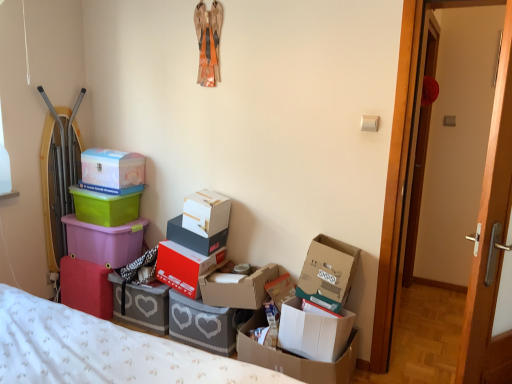
Question: Could you tell me if green plastic container at upper left, which is the 2th box from left to right, is facing cardboard box at right, which is counted as the 12th box, starting from the left?

Choices:
 (A) yes
 (B) no

Answer: (B)

Question: Does green plastic container at upper left, positioned as the 11th box in right-to-left order, have a larger size compared to cardboard box at right, which is counted as the 1th box, starting from the right?

Choices:
 (A) yes
 (B) no

Answer: (B)

Question: Can you confirm if green plastic container at upper left, which is the 2th box from left to right, is positioned to the right of cardboard box at right, which is counted as the 1th box, starting from the right?

Choices:
 (A) no
 (B) yes

Answer: (A)

Question: Is green plastic container at upper left, which is the 2th box from left to right, not inside cardboard box at right, which is counted as the 1th box, starting from the right?

Choices:
 (A) yes
 (B) no

Answer: (A)

Question: Is green plastic container at upper left, which is the 2th box from left to right, taller than cardboard box at right, which is counted as the 12th box, starting from the left?

Choices:
 (A) no
 (B) yes

Answer: (A)

Question: From the image's perspective, relative to wooden door at right, marked as the 2th door in a front-to-back arrangement, is red matte shoebox at center, marked as the fifth box in a left-to-right arrangement, above or below?

Choices:
 (A) below
 (B) above

Answer: (A)

Question: Relative to wooden door at right, marked as the 2th door in a front-to-back arrangement, is red matte shoebox at center, which appears as the eighth box when viewed from the right, in front or behind?

Choices:
 (A) behind
 (B) front

Answer: (A)

Question: Visually, is red matte shoebox at center, which appears as the eighth box when viewed from the right, positioned to the left or to the right of wooden door at right, marked as the 2th door in a front-to-back arrangement?

Choices:
 (A) right
 (B) left

Answer: (B)

Question: Would you say red matte shoebox at center, which appears as the eighth box when viewed from the right, is inside or outside wooden door at right, marked as the 2th door in a front-to-back arrangement?

Choices:
 (A) outside
 (B) inside

Answer: (A)

Question: Is matte white plastic box at upper left, acting as the tenth box starting from the right, taller or shorter than cardboard box at center, acting as the 9th box starting from the left?

Choices:
 (A) short
 (B) tall

Answer: (B)

Question: Choose the correct answer: Is matte white plastic box at upper left, acting as the tenth box starting from the right, inside cardboard box at center, which ranks as the fourth box in right-to-left order, or outside it?

Choices:
 (A) inside
 (B) outside

Answer: (B)

Question: Considering the positions of matte white plastic box at upper left, which appears as the 3th box when viewed from the left, and cardboard box at center, acting as the 9th box starting from the left, in the image, is matte white plastic box at upper left, which appears as the 3th box when viewed from the left, bigger or smaller than cardboard box at center, acting as the 9th box starting from the left,?

Choices:
 (A) big
 (B) small

Answer: (B)

Question: From a real-world perspective, is matte white plastic box at upper left, acting as the tenth box starting from the right, above or below cardboard box at center, which ranks as the fourth box in right-to-left order?

Choices:
 (A) above
 (B) below

Answer: (A)

Question: Would you say white cardboard box at lower right, the second box when ordered from right to left, is to the left or to the right of green plastic container at upper left, which is the 2th box from left to right, in the picture?

Choices:
 (A) left
 (B) right

Answer: (B)

Question: From the image's perspective, is white cardboard box at lower right, which ranks as the 11th box in left-to-right order, located above or below green plastic container at upper left, which is the 2th box from left to right?

Choices:
 (A) above
 (B) below

Answer: (B)